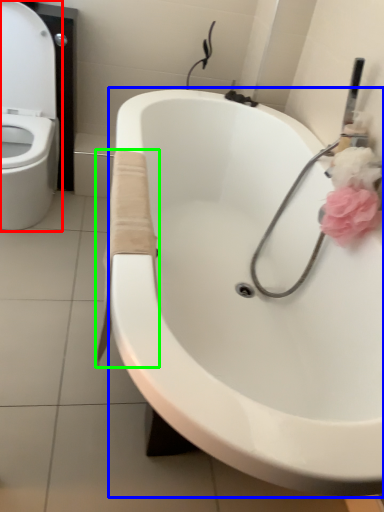
Question: Based on their relative distances, which object is farther from toilet (highlighted by a red box)? Choose from sink (highlighted by a blue box) and material (highlighted by a green box).

Choices:
 (A) sink
 (B) material

Answer: (B)